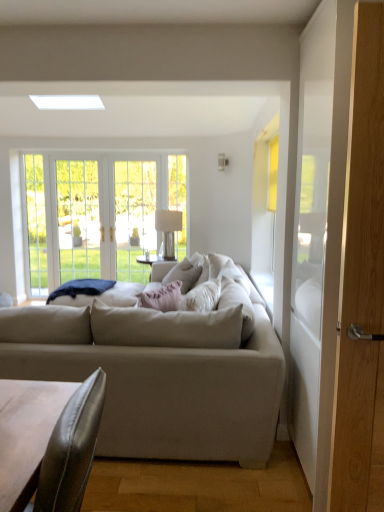
Measure the distance between clear glass door at center and camera.

5.54 meters.

The image size is (384, 512). Describe the element at coordinates (160, 375) in the screenshot. I see `beige fabric couch at center` at that location.

Locate an element on the screen. The image size is (384, 512). wooden screen door at right, marked as the first screen door in a front-to-back arrangement is located at coordinates (361, 284).

The height and width of the screenshot is (512, 384). I want to click on clear glass screen door at center, the 1th screen door positioned from the back, so click(x=134, y=217).

Which point is more distant from viewer, [117,260] or [352,415]?

The point [117,260] is more distant.

Does clear glass screen door at center, the 2th screen door when ordered from front to back, have a smaller size compared to wooden screen door at right, acting as the 2th screen door starting from the back?

Correct, clear glass screen door at center, the 2th screen door when ordered from front to back, occupies less space than wooden screen door at right, acting as the 2th screen door starting from the back.

Between clear glass screen door at center, positioned as the 2th screen door in right-to-left order, and wooden screen door at right, acting as the 2th screen door starting from the back, which one has more height?

With more height is wooden screen door at right, acting as the 2th screen door starting from the back.

Is clear glass screen door at center, positioned as the 2th screen door in right-to-left order, positioned behind wooden screen door at right, acting as the 2th screen door starting from the back?

That is True.

Is the position of blue fabric pillow at center more distant than that of clear glass door at center?

No, blue fabric pillow at center is closer to the camera.

Which object is thinner, blue fabric pillow at center or clear glass door at center?

clear glass door at center is thinner.

Is point (88, 281) closer to camera compared to point (73, 177)?

Yes, it is in front of point (73, 177).

Visually, is blue fabric pillow at center positioned to the left or to the right of clear glass door at center?

Based on their positions, blue fabric pillow at center is located to the right of clear glass door at center.

Which object is further away from the camera, clear glass door at left or wooden screen door at right, positioned as the first screen door in right-to-left order?

Positioned behind is clear glass door at left.

Considering the sizes of objects clear glass door at left and wooden screen door at right, positioned as the first screen door in right-to-left order, in the image provided, who is bigger, clear glass door at left or wooden screen door at right, positioned as the first screen door in right-to-left order,?

wooden screen door at right, positioned as the first screen door in right-to-left order.

Can you tell me how much clear glass door at left and wooden screen door at right, positioned as the first screen door in right-to-left order, differ in facing direction?

The angle between the facing direction of clear glass door at left and the facing direction of wooden screen door at right, positioned as the first screen door in right-to-left order, is 90.3 degrees.

Can you confirm if clear glass door at left is positioned to the left of wooden screen door at right, positioned as the first screen door in right-to-left order?

Indeed, clear glass door at left is positioned on the left side of wooden screen door at right, positioned as the first screen door in right-to-left order.

From the picture: From a real-world perspective, who is located higher, wooden screen door at right, placed as the second screen door when sorted from left to right, or clear glass door at center?

wooden screen door at right, placed as the second screen door when sorted from left to right, from a real-world perspective.

Is wooden screen door at right, acting as the 2th screen door starting from the back, facing away from clear glass door at center?

wooden screen door at right, acting as the 2th screen door starting from the back, is not turned away from clear glass door at center.

Is wooden screen door at right, positioned as the first screen door in right-to-left order, wider than clear glass door at center?

Correct, the width of wooden screen door at right, positioned as the first screen door in right-to-left order, exceeds that of clear glass door at center.

Is wooden screen door at right, marked as the first screen door in a front-to-back arrangement, shorter than clear glass door at center?

No, wooden screen door at right, marked as the first screen door in a front-to-back arrangement, is not shorter than clear glass door at center.

Looking at this image, is blue fabric pillow at center completely or partially outside of leather-like brown coffee table at lower left?

Indeed, blue fabric pillow at center is completely outside leather-like brown coffee table at lower left.

Is blue fabric pillow at center at the left side of leather-like brown coffee table at lower left?

Indeed, blue fabric pillow at center is positioned on the left side of leather-like brown coffee table at lower left.

From the image's perspective, is blue fabric pillow at center over leather-like brown coffee table at lower left?

Yes, from the image's perspective, blue fabric pillow at center is over leather-like brown coffee table at lower left.

Where is `coffee table that appears above the blue fabric pillow at center (from a real-world perspective)`? The width and height of the screenshot is (384, 512). coffee table that appears above the blue fabric pillow at center (from a real-world perspective) is located at coordinates (26, 434).

Considering the points (40, 408) and (197, 268), which point is in front, point (40, 408) or point (197, 268)?

The point (40, 408) is closer.

Is the surface of leather-like brown coffee table at lower left in direct contact with pink fabric pillow at center?

There is a gap between leather-like brown coffee table at lower left and pink fabric pillow at center.

Between leather-like brown coffee table at lower left and pink fabric pillow at center, which one has smaller width?

pink fabric pillow at center.

From a real-world perspective, is clear glass door at center positioned under clear glass door at left based on gravity?

No, from a real-world perspective, clear glass door at center is not beneath clear glass door at left.

Is point (81, 230) farther from viewer compared to point (38, 219)?

Yes.

Would you say clear glass door at center is inside or outside clear glass door at left?

clear glass door at center is not inside clear glass door at left, it's outside.

Measure the distance between clear glass door at center and clear glass door at left.

clear glass door at center and clear glass door at left are 44.05 centimeters apart.

At what (x,y) coordinates should I click in order to perform the action: click on screen door that appears above the clear glass screen door at center, which is the first screen door in left-to-right order (from a real-world perspective). Please return your answer as a coordinate pair (x, y). This screenshot has width=384, height=512. Looking at the image, I should click on (361, 284).

You are a GUI agent. You are given a task and a screenshot of the screen. Output one action in this format:
    pyautogui.click(x=<x>, y=<y>)
    Task: Click on the glass door behind the blue fabric pillow at center
    The width and height of the screenshot is (384, 512).
    Given the screenshot: What is the action you would take?
    pyautogui.click(x=78, y=219)

When comparing their distances from metallic silver lamp at center, does clear glass door at left or beige fabric couch at center seem closer?

Based on the image, clear glass door at left appears to be nearer to metallic silver lamp at center.

When comparing their distances from beige fabric couch at center, does pink fabric pillow at center or clear glass door at center seem closer?

The object closer to beige fabric couch at center is pink fabric pillow at center.

Considering their positions, is clear glass screen door at center, the 2th screen door when ordered from front to back, positioned further to blue fabric pillow at center than clear glass door at center?

Based on the image, clear glass screen door at center, the 2th screen door when ordered from front to back, appears to be further to blue fabric pillow at center.

Estimate the real-world distances between objects in this image. Which object is closer to clear glass screen door at center, which is the first screen door in left-to-right order, blue fabric pillow at center or clear glass door at center?

Among the two, clear glass door at center is located nearer to clear glass screen door at center, which is the first screen door in left-to-right order.

Estimate the real-world distances between objects in this image. Which object is closer to blue fabric pillow at center, leather-like brown coffee table at lower left or metallic silver lamp at center?

The object closer to blue fabric pillow at center is metallic silver lamp at center.

From the image, which object appears to be nearer to clear glass screen door at center, positioned as the 2th screen door in right-to-left order, beige fabric couch at center or clear glass door at left?

clear glass door at left.

From the image, which object appears to be nearer to clear glass door at center, beige fabric couch at center or clear glass screen door at center, the 1th screen door positioned from the back?

clear glass screen door at center, the 1th screen door positioned from the back.

Which object lies further to the anchor point clear glass screen door at center, the 2th screen door when ordered from front to back, leather-like brown coffee table at lower left or beige fabric couch at center?

leather-like brown coffee table at lower left.

I want to click on wide positioned between leather-like brown coffee table at lower left and pink fabric pillow at center from near to far, so click(x=95, y=293).

Locate an element on the screen. Image resolution: width=384 pixels, height=512 pixels. wide positioned between beige fabric couch at center and clear glass door at left from near to far is located at coordinates (95, 293).

The image size is (384, 512). Find the location of `pillow located between wooden screen door at right, acting as the 2th screen door starting from the back, and metallic silver lamp at center in the depth direction`. pillow located between wooden screen door at right, acting as the 2th screen door starting from the back, and metallic silver lamp at center in the depth direction is located at coordinates (184, 274).

Where is `wide between clear glass door at left and pink fabric pillow at center`? Image resolution: width=384 pixels, height=512 pixels. wide between clear glass door at left and pink fabric pillow at center is located at coordinates (95, 293).